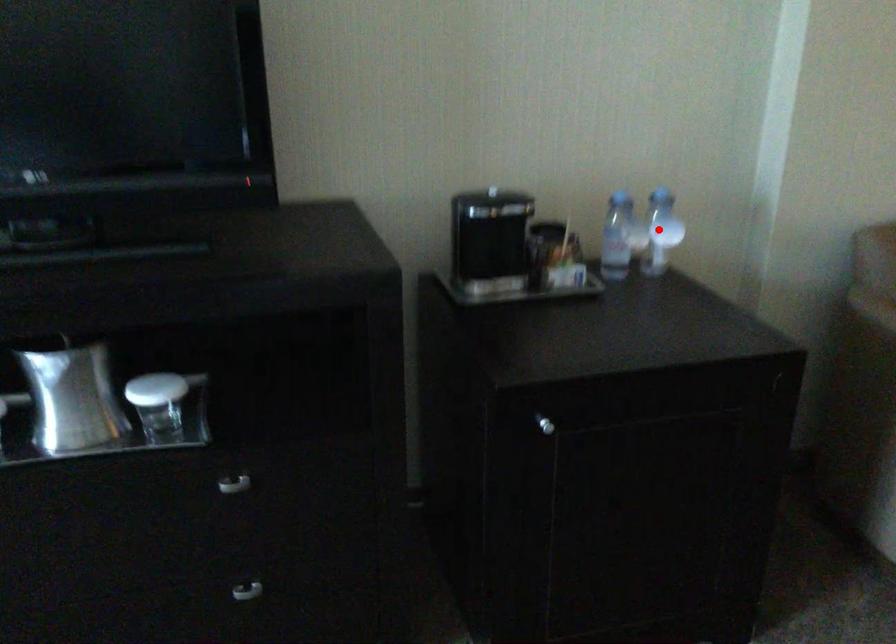
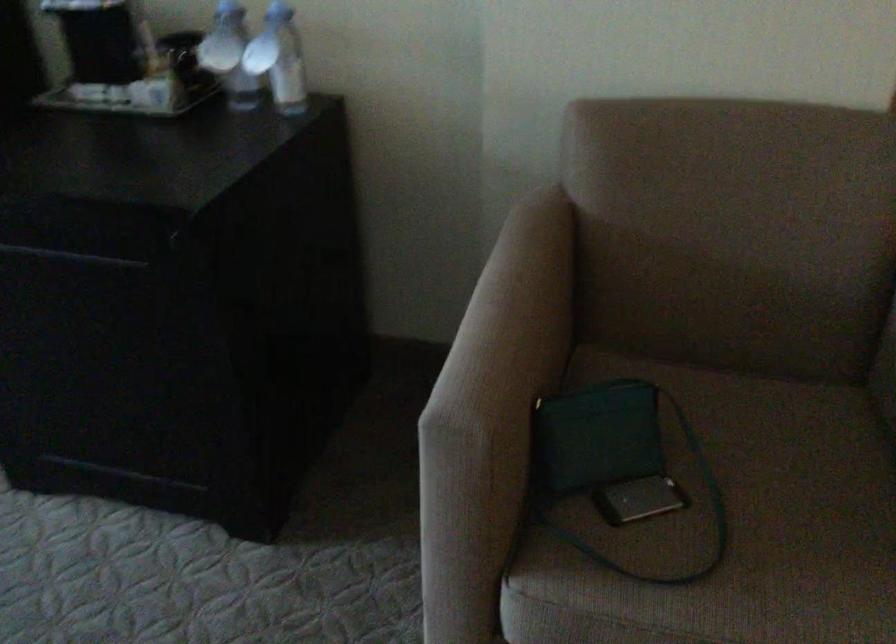
Question: I am providing you with two images of the same scene from different viewpoints. In image1, a red point is highlighted. Considering the same 3D point in image2, which of the following is correct?

Choices:
 (A) It is closer
 (B) It is farther

Answer: (A)